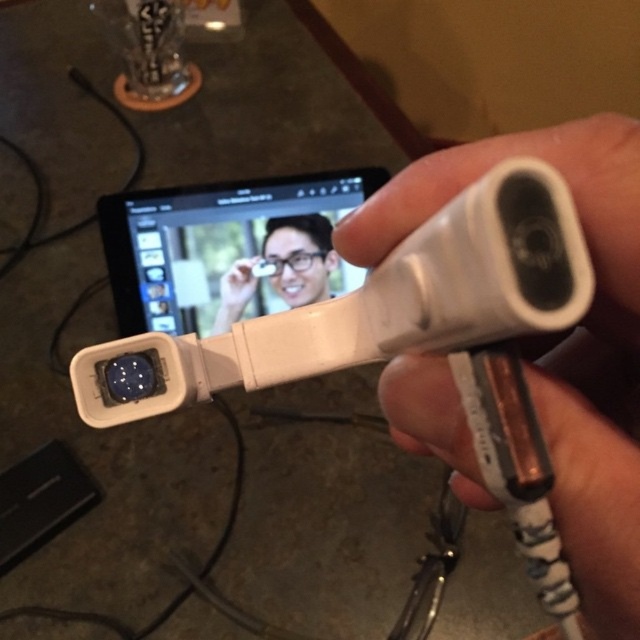
Question: Can you confirm if white matte plastic controller at center is wider than white plastic remote control at center?

Choices:
 (A) no
 (B) yes

Answer: (A)

Question: Considering the real-world distances, which object is closest to the matte white phone at center?

Choices:
 (A) white plastic remote control at center
 (B) black glossy tablet at center

Answer: (B)

Question: Does white plastic remote control at center appear on the left side of black glossy tablet at center?

Choices:
 (A) no
 (B) yes

Answer: (A)

Question: Is white matte plastic controller at center thinner than matte white phone at center?

Choices:
 (A) yes
 (B) no

Answer: (B)

Question: Which point is closer to the camera?

Choices:
 (A) (208, 316)
 (B) (291, 243)

Answer: (A)

Question: Estimate the real-world distances between objects in this image. Which object is farther from the white plastic remote control at center?

Choices:
 (A) white matte plastic controller at center
 (B) matte white phone at center
 (C) black glossy tablet at center

Answer: (B)